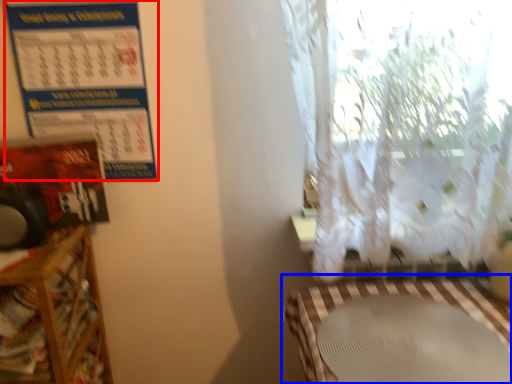
Question: Among these objects, which one is farthest to the camera, calendar (highlighted by a red box) or table (highlighted by a blue box)?

Choices:
 (A) calendar
 (B) table

Answer: (A)